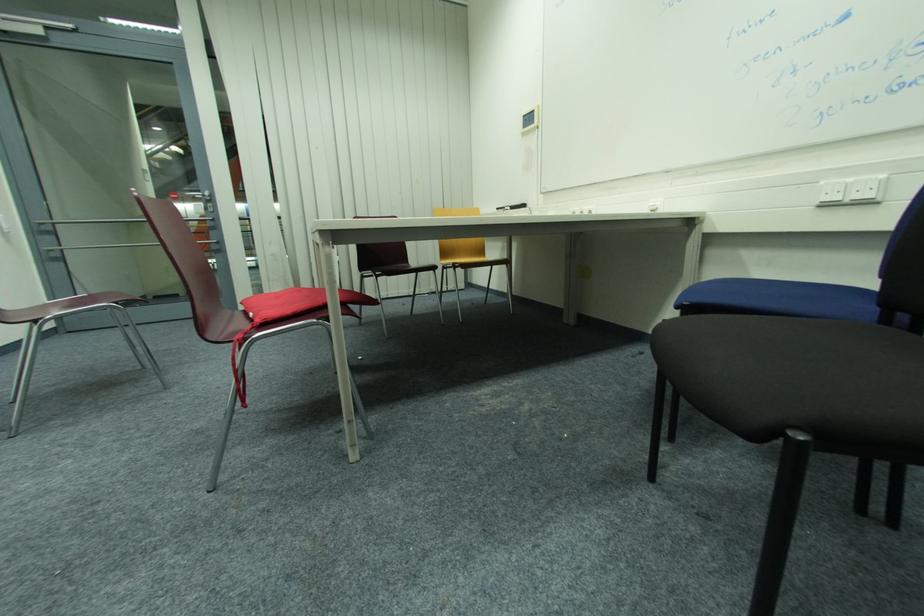
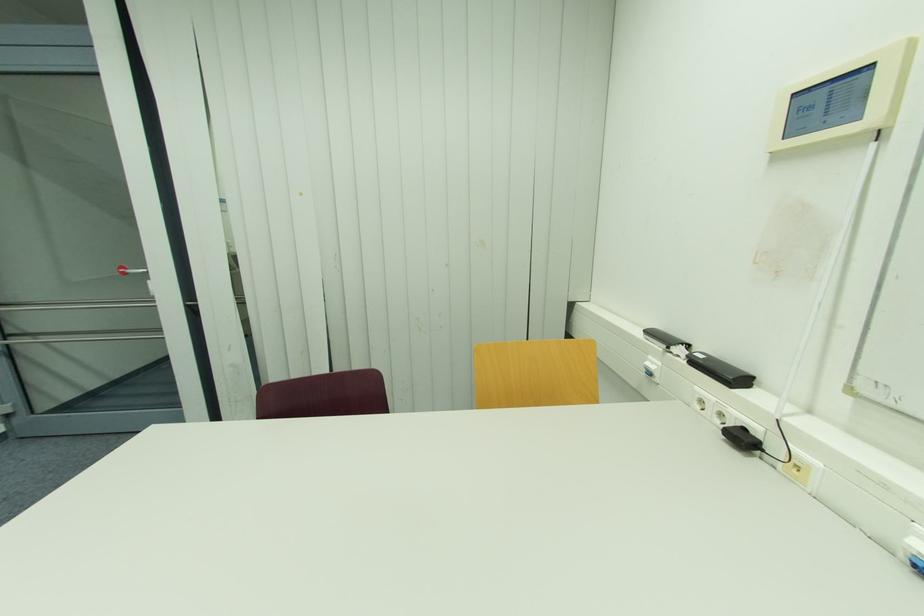
Question: In a continuous first-person perspective shot, in which direction is the camera moving?

Choices:
 (A) Left
 (B) Right
 (C) Forward
 (D) Backward

Answer: (C)